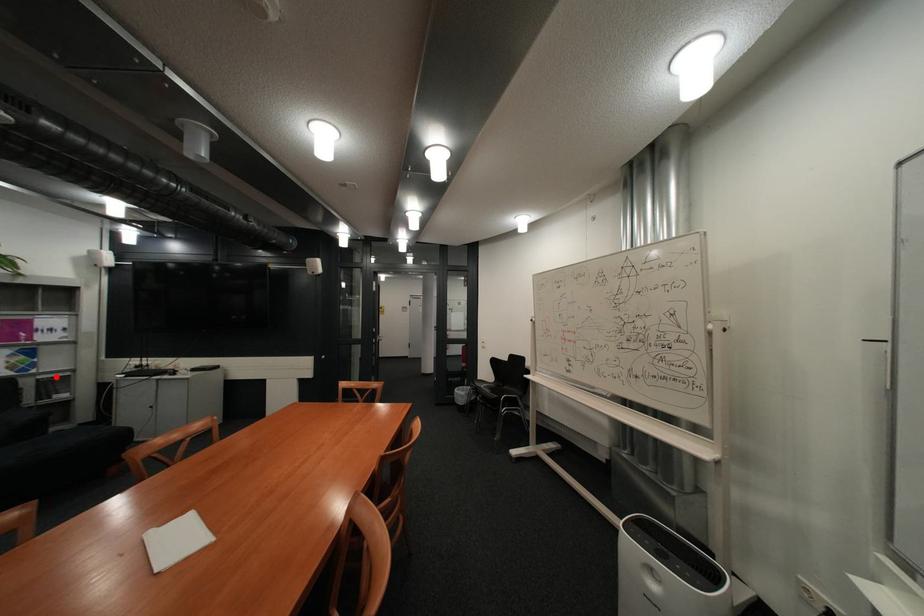
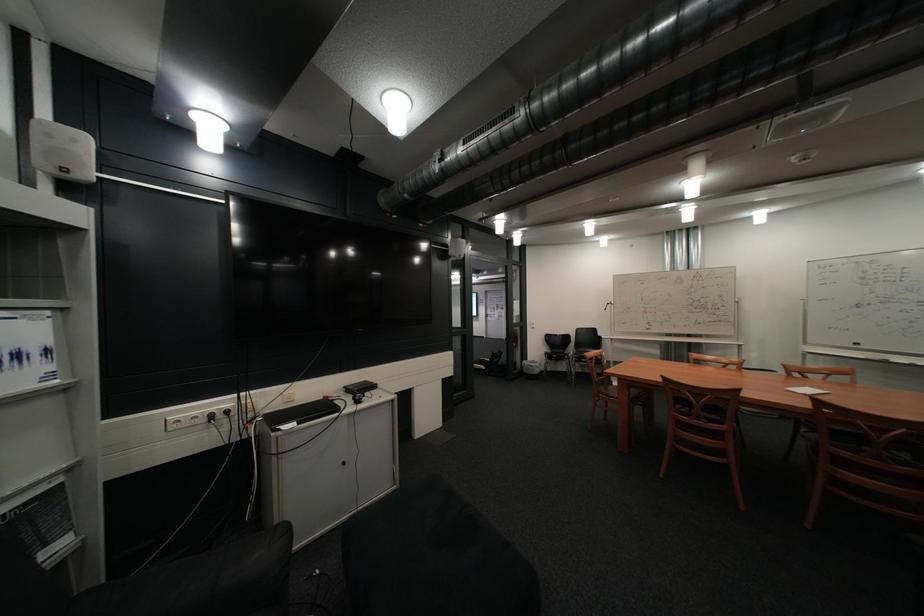
Locate, in the second image, the point that corresponds to the highlighted location in the first image.

(10, 514)